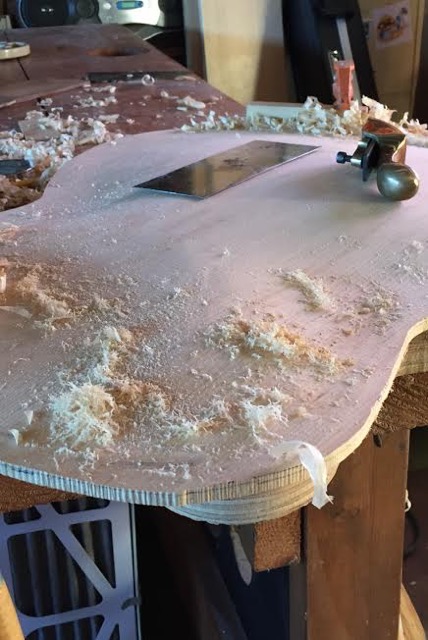
I want to click on wood table leg, so click(x=366, y=594).